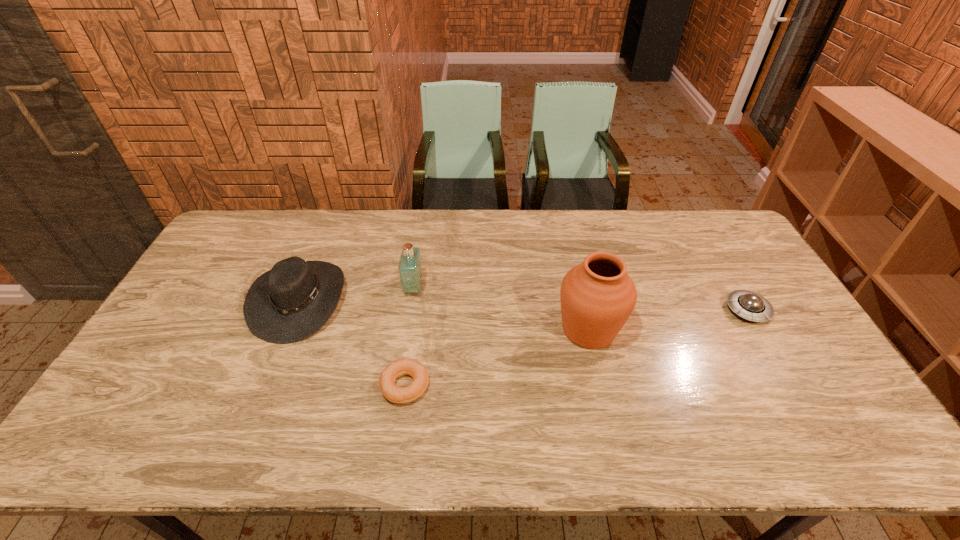
I want to click on free spot between the tallest object and the rightmost object, so click(668, 320).

The image size is (960, 540). I want to click on vacant area that lies between the second object from right to left and the perfume, so click(501, 308).

Image resolution: width=960 pixels, height=540 pixels. I want to click on unoccupied position between the urn and the perfume, so click(x=501, y=308).

This screenshot has width=960, height=540. Identify the location of unoccupied area between the leftmost object and the urn. (444, 315).

Where is `vacant point located between the bagel and the urn`? This screenshot has width=960, height=540. vacant point located between the bagel and the urn is located at coordinates (496, 357).

Identify the location of empty space that is in between the leftmost object and the tallest object. pyautogui.click(x=444, y=315).

You are a GUI agent. You are given a task and a screenshot of the screen. Output one action in this format:
    pyautogui.click(x=<x>, y=<y>)
    Task: Click on the free space between the fourth shortest object and the cowboy hat
    
    Given the screenshot: What is the action you would take?
    pyautogui.click(x=356, y=294)

Locate an element on the screen. free space between the saucer and the third shortest object is located at coordinates (523, 305).

Where is `vacant area that lies between the second tallest object and the tallest object`? vacant area that lies between the second tallest object and the tallest object is located at coordinates (501, 308).

Locate an element on the screen. The height and width of the screenshot is (540, 960). object that is the closest one to the nearest object is located at coordinates (289, 303).